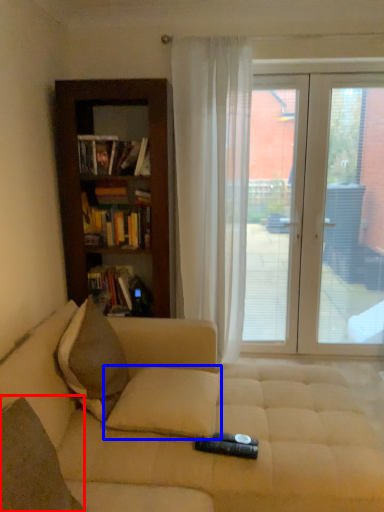
Question: Among these objects, which one is nearest to the camera, pillow (highlighted by a red box) or pillow (highlighted by a blue box)?

Choices:
 (A) pillow
 (B) pillow

Answer: (A)